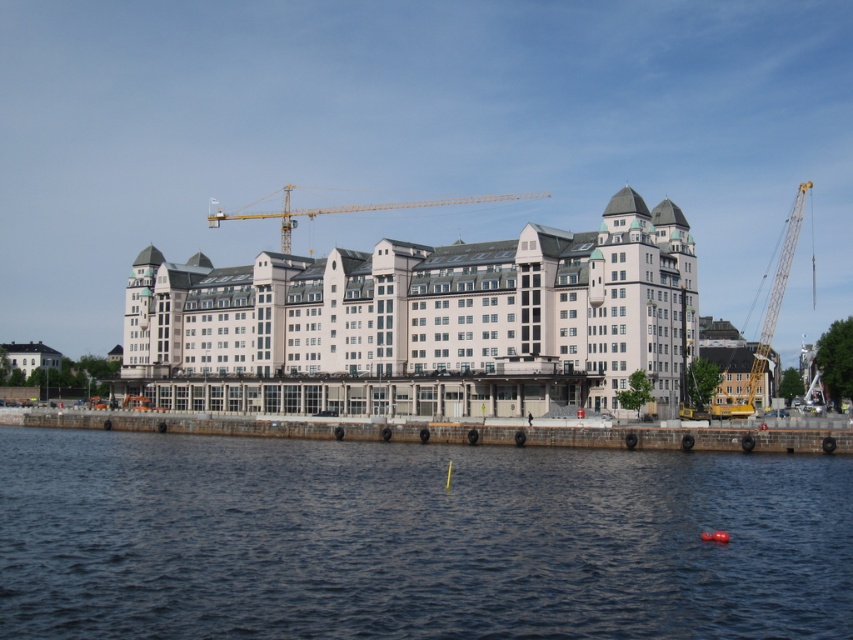
Question: Which of these objects is positioned closest to the yellow metallic crane at right?

Choices:
 (A) dark blue water at lower center
 (B) white smooth building at center
 (C) yellow metallic crane at center

Answer: (B)

Question: Estimate the real-world distances between objects in this image. Which object is closer to the yellow metallic crane at right?

Choices:
 (A) white smooth building at center
 (B) dark blue water at lower center

Answer: (A)

Question: Which point is closer to the camera?

Choices:
 (A) (170, 269)
 (B) (329, 461)
 (C) (279, 246)
 (D) (715, 412)

Answer: (B)

Question: Is dark blue water at lower center to the right of yellow metallic crane at center from the viewer's perspective?

Choices:
 (A) yes
 (B) no

Answer: (A)

Question: Observing the image, what is the correct spatial positioning of white smooth building at center in reference to yellow metallic crane at center?

Choices:
 (A) left
 (B) right

Answer: (A)

Question: Is dark blue water at lower center to the left of yellow metallic crane at center from the viewer's perspective?

Choices:
 (A) yes
 (B) no

Answer: (B)